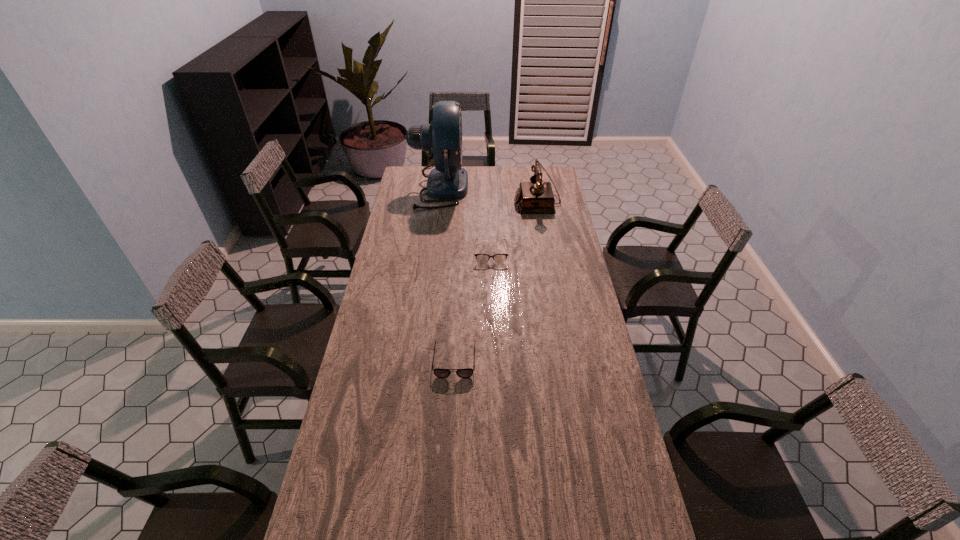
Identify the location of free space that is in between the nearest object and the tallest object. (446, 274).

Locate an element on the screen. This screenshot has width=960, height=540. free point between the rightmost object and the fan is located at coordinates (488, 195).

I want to click on object that can be found as the second closest to the tallest object, so click(x=481, y=258).

I want to click on the closest object to the nearest object, so click(398, 255).

Select which spectacles is the closest to the tallest object. Please provide its 2D coordinates. Your answer should be formatted as a tuple, i.e. [(x, y)], where the tuple contains the x and y coordinates of a point satisfying the conditions above.

[(481, 258)]

Select which spectacles is the closest to the rightmost object. Please provide its 2D coordinates. Your answer should be formatted as a tuple, i.e. [(x, y)], where the tuple contains the x and y coordinates of a point satisfying the conditions above.

[(481, 258)]